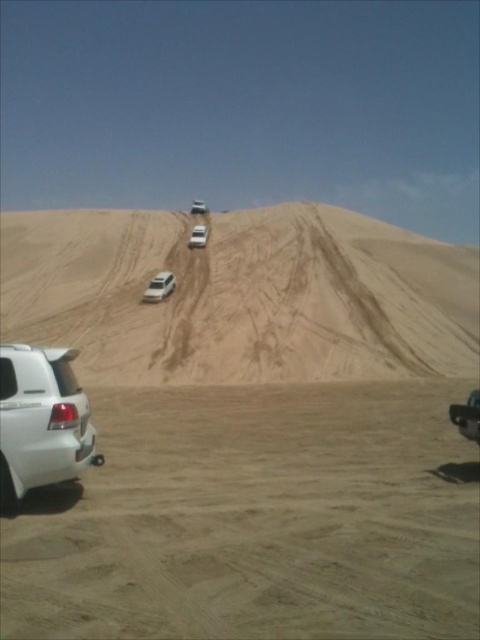
Question: Does metallic silver car at lower right come in front of sandy beige suv at center?

Choices:
 (A) yes
 (B) no

Answer: (A)

Question: Does white matte suv at lower left appear over white matte suv at upper center?

Choices:
 (A) yes
 (B) no

Answer: (B)

Question: Which object is closer to the camera taking this photo?

Choices:
 (A) white sand dirt track at lower left
 (B) white matte car at upper center

Answer: (A)

Question: Which point is closer to the camera?

Choices:
 (A) (202, 208)
 (B) (300, 291)
 (C) (48, 442)

Answer: (C)

Question: Which of these objects is positioned closest to the white matte car at upper center?

Choices:
 (A) white sand dirt track at lower left
 (B) sandy/dry sand dune at center
 (C) white matte suv at lower left
 (D) metallic silver car at lower right

Answer: (B)

Question: Is white sand dirt track at lower left above white matte suv at lower left?

Choices:
 (A) yes
 (B) no

Answer: (B)